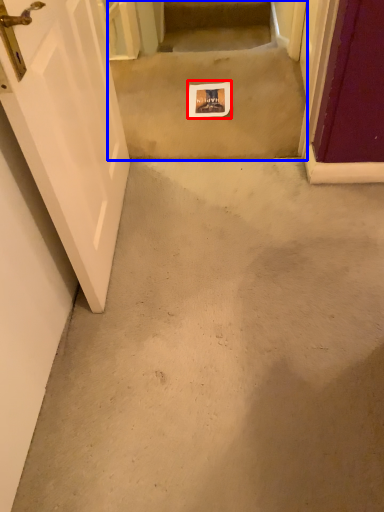
Question: Which object appears farthest to the camera in this image, postcard (highlighted by a red box) or stairwell (highlighted by a blue box)?

Choices:
 (A) postcard
 (B) stairwell

Answer: (A)